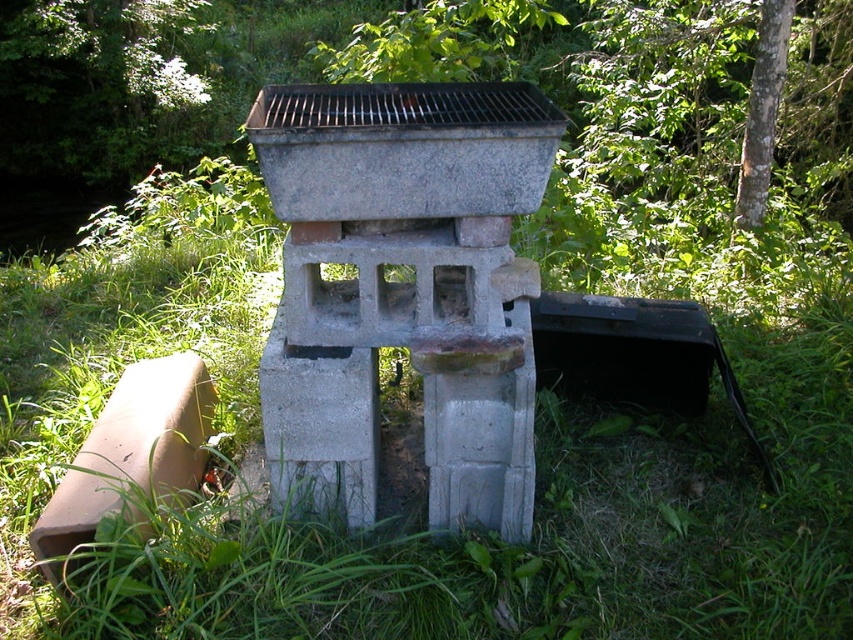
Consider the image. Between green grass at center and green leafy tree at upper center, which one is positioned lower?

Positioned lower is green grass at center.

Does green grass at center appear on the right side of green leafy tree at upper center?

Incorrect, green grass at center is not on the right side of green leafy tree at upper center.

Which is in front, point (160, 611) or point (764, 12)?

Point (160, 611) is more forward.

This screenshot has height=640, width=853. Identify the location of green grass at center. (461, 538).